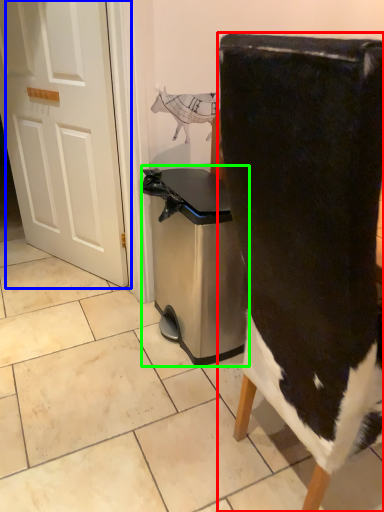
Question: Which object is positioned farthest from chair (highlighted by a red box)? Select from door (highlighted by a blue box) and dish washer (highlighted by a green box).

Choices:
 (A) door
 (B) dish washer

Answer: (A)